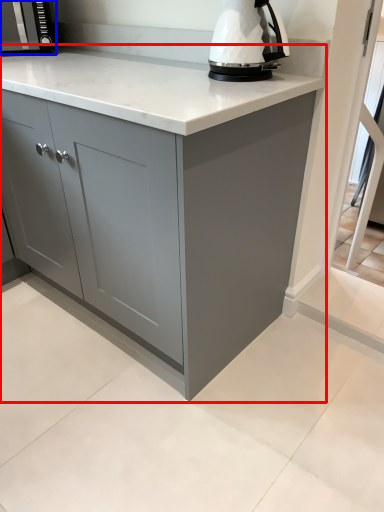
Question: Which object is further to the camera taking this photo, cabinetry (highlighted by a red box) or kitchen appliance (highlighted by a blue box)?

Choices:
 (A) cabinetry
 (B) kitchen appliance

Answer: (B)